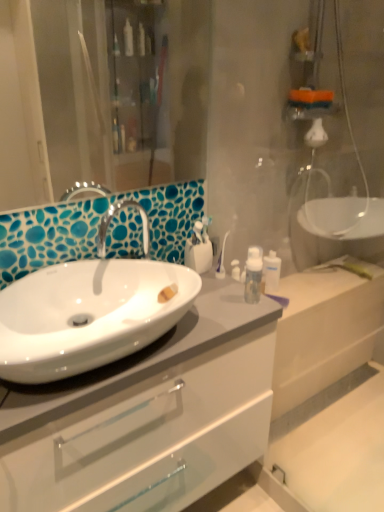
Question: Considering the relative sizes of white glossy cabinet at center and transparent plastic bottle at upper right, which is counted as the 1th toiletry, starting from the right, in the image provided, is white glossy cabinet at center taller than transparent plastic bottle at upper right, which is counted as the 1th toiletry, starting from the right,?

Choices:
 (A) yes
 (B) no

Answer: (A)

Question: From a real-world perspective, is white glossy cabinet at center positioned over transparent plastic bottle at upper right, the 1th toiletry from the back, based on gravity?

Choices:
 (A) yes
 (B) no

Answer: (B)

Question: Does white glossy cabinet at center appear on the left side of transparent plastic bottle at upper right, the second toiletry viewed from the left?

Choices:
 (A) no
 (B) yes

Answer: (B)

Question: Is white glossy cabinet at center smaller than transparent plastic bottle at upper right, acting as the 2th toiletry starting from the front?

Choices:
 (A) no
 (B) yes

Answer: (A)

Question: Does white glossy cabinet at center turn towards transparent plastic bottle at upper right, which is counted as the 1th toiletry, starting from the right?

Choices:
 (A) no
 (B) yes

Answer: (A)

Question: Considering the positions of white glossy cabinet at center and white glossy toothbrush holder at center, the second toiletry when ordered from right to left, in the image, is white glossy cabinet at center wider or thinner than white glossy toothbrush holder at center, the second toiletry when ordered from right to left,?

Choices:
 (A) thin
 (B) wide

Answer: (B)

Question: Would you say white glossy cabinet at center is inside or outside white glossy toothbrush holder at center, the 1th toiletry in the left-to-right sequence?

Choices:
 (A) inside
 (B) outside

Answer: (B)

Question: From the image's perspective, is white glossy cabinet at center above or below white glossy toothbrush holder at center, the 1th toiletry in the left-to-right sequence?

Choices:
 (A) above
 (B) below

Answer: (B)

Question: From a real-world perspective, is white glossy cabinet at center positioned above or below white glossy toothbrush holder at center, the 1th toiletry in the left-to-right sequence?

Choices:
 (A) above
 (B) below

Answer: (B)

Question: From the image's perspective, is white glossy sink at center left located above or below white glossy cabinet at center?

Choices:
 (A) below
 (B) above

Answer: (B)

Question: From a real-world perspective, is white glossy sink at center left positioned above or below white glossy cabinet at center?

Choices:
 (A) below
 (B) above

Answer: (B)

Question: Considering the positions of white glossy sink at center left and white glossy cabinet at center in the image, is white glossy sink at center left wider or thinner than white glossy cabinet at center?

Choices:
 (A) wide
 (B) thin

Answer: (B)

Question: Choose the correct answer: Is white glossy sink at center left inside white glossy cabinet at center or outside it?

Choices:
 (A) outside
 (B) inside

Answer: (A)

Question: In terms of size, does white glossy cabinet at center appear bigger or smaller than white glossy sink at center left?

Choices:
 (A) small
 (B) big

Answer: (B)

Question: Considering their positions, is white glossy cabinet at center located in front of or behind white glossy sink at center left?

Choices:
 (A) front
 (B) behind

Answer: (B)